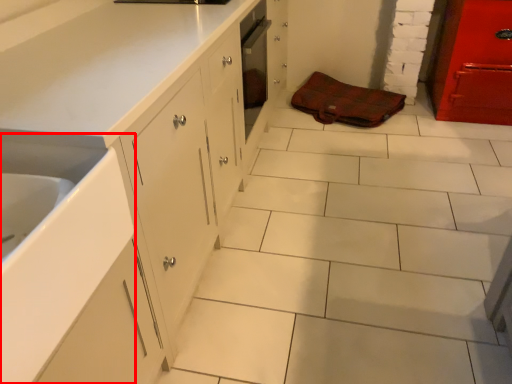
Question: Where is sink (annotated by the red box) located in relation to material in the image?

Choices:
 (A) left
 (B) right

Answer: (A)